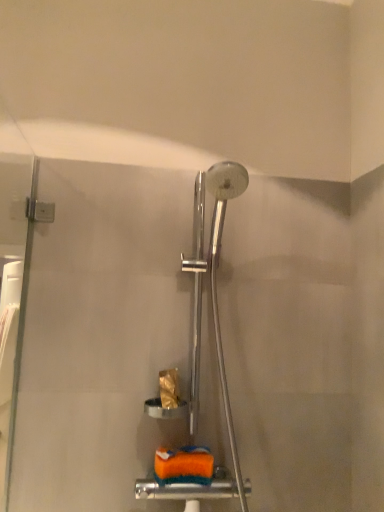
Question: Could you tell me if orange sponge at lower center is facing gold textured toilet paper at center?

Choices:
 (A) no
 (B) yes

Answer: (A)

Question: From a real-world perspective, does orange sponge at lower center sit lower than gold textured toilet paper at center?

Choices:
 (A) yes
 (B) no

Answer: (A)

Question: Is orange sponge at lower center wider than gold textured toilet paper at center?

Choices:
 (A) yes
 (B) no

Answer: (A)

Question: Would you say gold textured toilet paper at center is part of orange sponge at lower center's contents?

Choices:
 (A) no
 (B) yes

Answer: (A)

Question: Are orange sponge at lower center and gold textured toilet paper at center beside each other?

Choices:
 (A) no
 (B) yes

Answer: (A)

Question: From the image's perspective, would you say orange sponge at lower center is shown under gold textured toilet paper at center?

Choices:
 (A) no
 (B) yes

Answer: (B)

Question: Is the depth of gold textured toilet paper at center greater than that of orange sponge at lower center?

Choices:
 (A) yes
 (B) no

Answer: (A)

Question: Is gold textured toilet paper at center far away from orange sponge at lower center?

Choices:
 (A) yes
 (B) no

Answer: (B)

Question: Does gold textured toilet paper at center appear on the right side of orange sponge at lower center?

Choices:
 (A) no
 (B) yes

Answer: (A)

Question: Is gold textured toilet paper at center positioned beyond the bounds of orange sponge at lower center?

Choices:
 (A) yes
 (B) no

Answer: (A)

Question: Could you tell me if gold textured toilet paper at center is turned towards orange sponge at lower center?

Choices:
 (A) yes
 (B) no

Answer: (B)

Question: From the image's perspective, is gold textured toilet paper at center located above orange sponge at lower center?

Choices:
 (A) no
 (B) yes

Answer: (B)

Question: Looking at the image, does gold textured toilet paper at center seem bigger or smaller compared to orange sponge at lower center?

Choices:
 (A) big
 (B) small

Answer: (B)